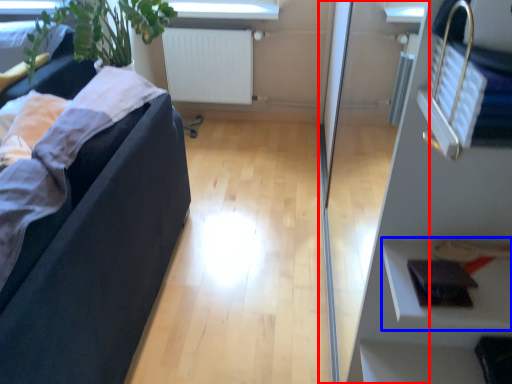
Question: Which point is further to the camera, glass door (highlighted by a red box) or shelf (highlighted by a blue box)?

Choices:
 (A) glass door
 (B) shelf

Answer: (B)